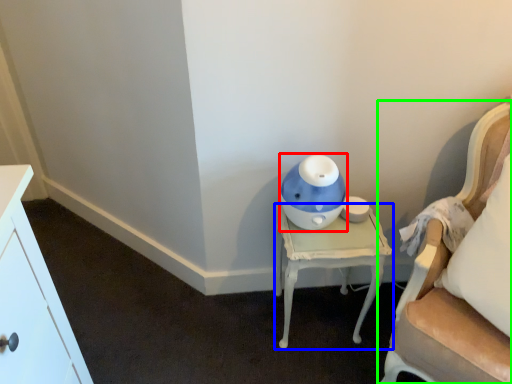
Question: Based on their relative distances, which object is farther from toy (highlighted by a red box)? Choose from nightstand (highlighted by a blue box) and chair (highlighted by a green box).

Choices:
 (A) nightstand
 (B) chair

Answer: (B)